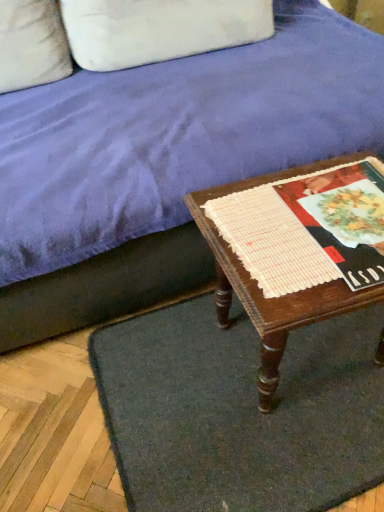
Question: Considering the relative sizes of wooden table at lower right and white woven placemat at center in the image provided, is wooden table at lower right thinner than white woven placemat at center?

Choices:
 (A) no
 (B) yes

Answer: (A)

Question: Considering the relative positions of wooden table at lower right and white woven placemat at center in the image provided, is wooden table at lower right to the left of white woven placemat at center from the viewer's perspective?

Choices:
 (A) yes
 (B) no

Answer: (B)

Question: Could you tell me if wooden table at lower right is facing white woven placemat at center?

Choices:
 (A) yes
 (B) no

Answer: (B)

Question: Can you confirm if wooden table at lower right is smaller than white woven placemat at center?

Choices:
 (A) yes
 (B) no

Answer: (B)

Question: From the image's perspective, is wooden table at lower right located above white woven placemat at center?

Choices:
 (A) no
 (B) yes

Answer: (A)

Question: In the image, is white woven placemat at center on the left side or the right side of velvet purple couch at upper center?

Choices:
 (A) left
 (B) right

Answer: (B)

Question: Is white woven placemat at center wider or thinner than velvet purple couch at upper center?

Choices:
 (A) wide
 (B) thin

Answer: (B)

Question: From the image's perspective, relative to velvet purple couch at upper center, is white woven placemat at center above or below?

Choices:
 (A) below
 (B) above

Answer: (A)

Question: Is point (284, 221) closer or farther from the camera than point (89, 250)?

Choices:
 (A) farther
 (B) closer

Answer: (B)

Question: Choose the correct answer: Is velvet purple couch at upper center inside wooden table at lower right or outside it?

Choices:
 (A) inside
 (B) outside

Answer: (B)

Question: Is point (350, 135) closer or farther from the camera than point (231, 256)?

Choices:
 (A) closer
 (B) farther

Answer: (B)

Question: Considering the positions of velvet purple couch at upper center and wooden table at lower right in the image, is velvet purple couch at upper center wider or thinner than wooden table at lower right?

Choices:
 (A) thin
 (B) wide

Answer: (B)

Question: Based on their sizes in the image, would you say velvet purple couch at upper center is bigger or smaller than wooden table at lower right?

Choices:
 (A) big
 (B) small

Answer: (A)

Question: Is white fabric pillow at upper left bigger or smaller than dark gray carpet at lower center?

Choices:
 (A) small
 (B) big

Answer: (B)

Question: Does point 269,24 appear closer or farther from the camera than point 188,362?

Choices:
 (A) closer
 (B) farther

Answer: (B)